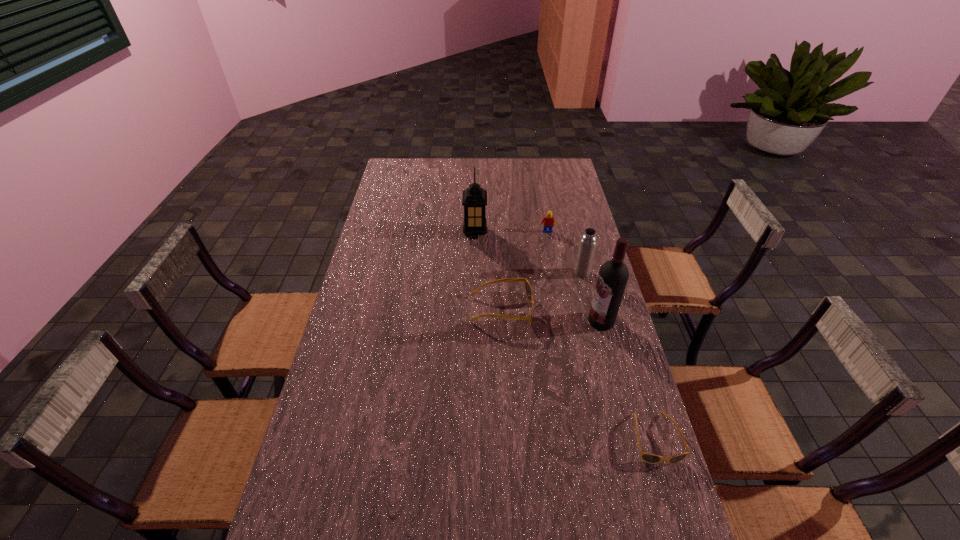
The width and height of the screenshot is (960, 540). In order to click on unoccupied area between the wine bottle and the fifth tallest object in this screenshot , I will do `click(551, 315)`.

Locate an element on the screen. free spot between the Lego and the nearer sunglasses is located at coordinates (600, 335).

I want to click on vacant space that's between the second tallest object and the wine bottle, so click(539, 277).

Where is `vacant space in between the wine bottle and the Lego`? The height and width of the screenshot is (540, 960). vacant space in between the wine bottle and the Lego is located at coordinates (574, 276).

Where is `empty space between the taller sunglasses and the nearest object`? empty space between the taller sunglasses and the nearest object is located at coordinates (578, 374).

I want to click on vacant space that's between the wine bottle and the shortest object, so click(628, 380).

Identify the location of empty space that is in between the shortest object and the fourth shortest object. The height and width of the screenshot is (540, 960). (618, 356).

You are a GUI agent. You are given a task and a screenshot of the screen. Output one action in this format:
    pyautogui.click(x=<x>, y=<y>)
    Task: Click on the vacant area that lies between the lantern and the shorter sunglasses
    The image size is (960, 540).
    Given the screenshot: What is the action you would take?
    pyautogui.click(x=564, y=335)

You are a GUI agent. You are given a task and a screenshot of the screen. Output one action in this format:
    pyautogui.click(x=<x>, y=<y>)
    Task: Click on the object that is the fifth nearest to the second tallest object
    
    Given the screenshot: What is the action you would take?
    pyautogui.click(x=650, y=458)

Locate which object ranks fourth in proximity to the shortest object. Please provide its 2D coordinates. Your answer should be formatted as a tuple, i.e. [(x, y)], where the tuple contains the x and y coordinates of a point satisfying the conditions above.

[(548, 221)]